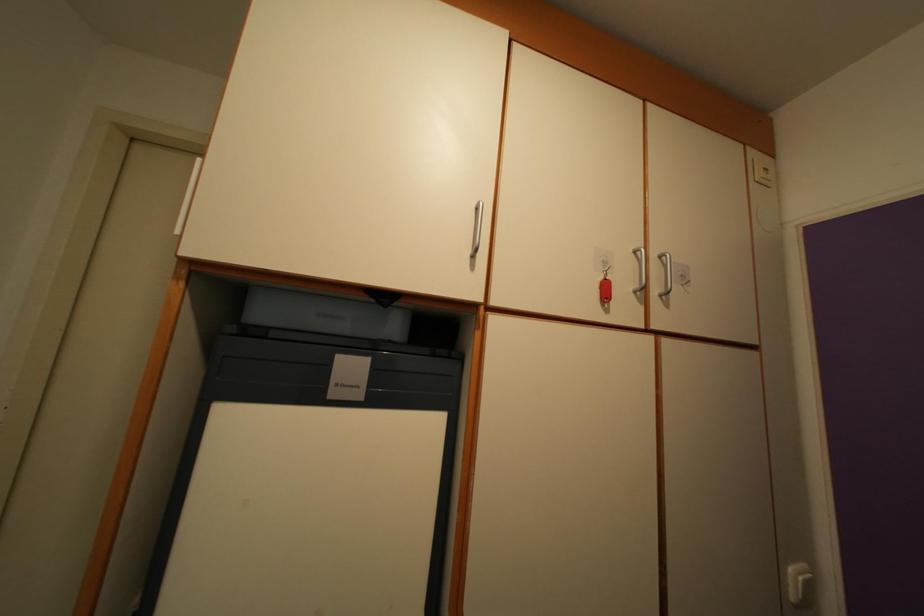
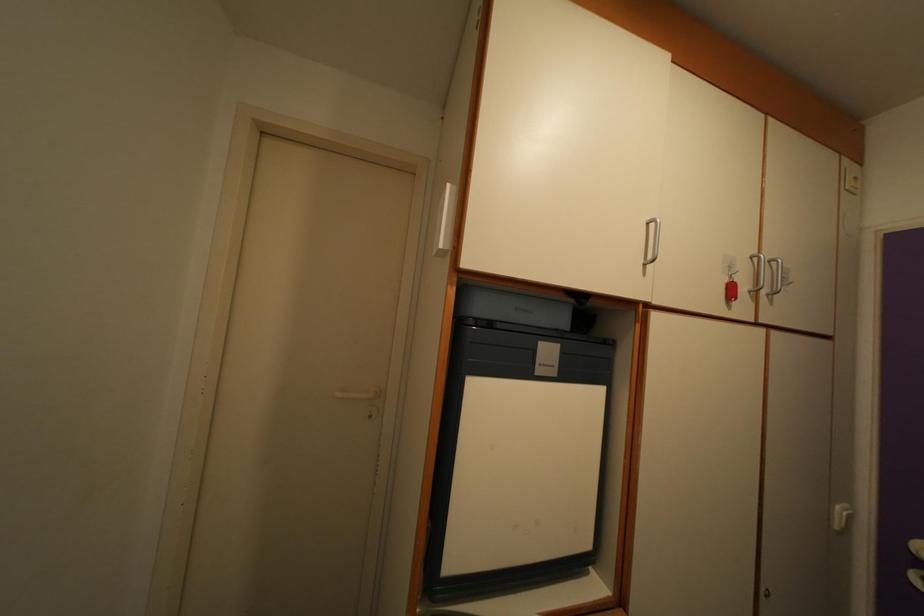
Find the pixel in the second image that matches [638,261] in the first image.

(755, 265)